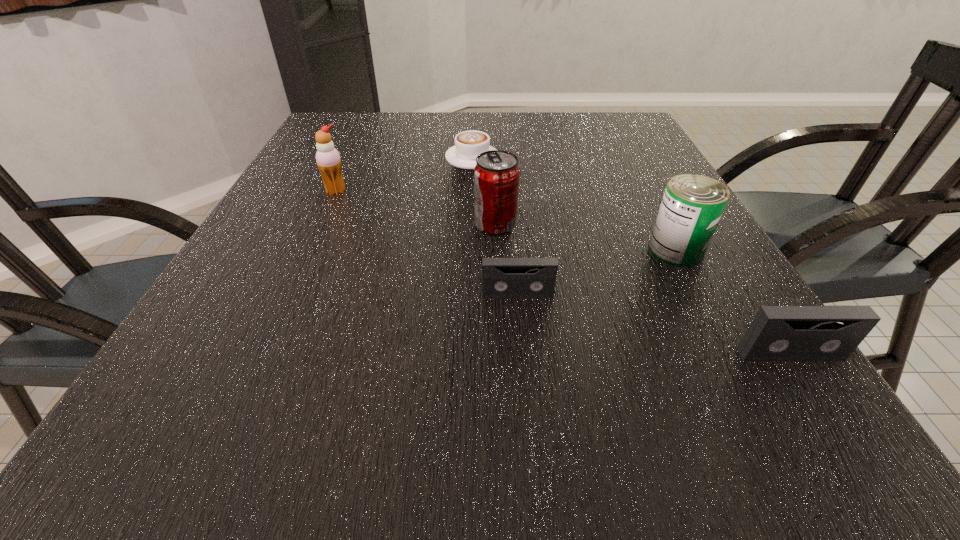
Identify the location of the shorter videotape. (501, 277).

Find the location of a particular element. the left videotape is located at coordinates (501, 277).

You are a GUI agent. You are given a task and a screenshot of the screen. Output one action in this format:
    pyautogui.click(x=<x>, y=<y>)
    Task: Click on the nearest object
    This screenshot has height=540, width=960.
    Given the screenshot: What is the action you would take?
    pyautogui.click(x=777, y=333)

Locate an element on the screen. This screenshot has height=540, width=960. the taller videotape is located at coordinates (777, 333).

At what (x,y) coordinates should I click in order to perform the action: click on the shortest object. Please return your answer as a coordinate pair (x, y). The height and width of the screenshot is (540, 960). Looking at the image, I should click on (469, 144).

The width and height of the screenshot is (960, 540). Identify the location of the farthest object. (469, 144).

I want to click on can, so click(692, 205).

The image size is (960, 540). I want to click on the leftmost object, so click(x=328, y=159).

In order to click on icecream in this screenshot , I will do `click(328, 159)`.

Where is `pop soda`? The width and height of the screenshot is (960, 540). pop soda is located at coordinates 496,175.